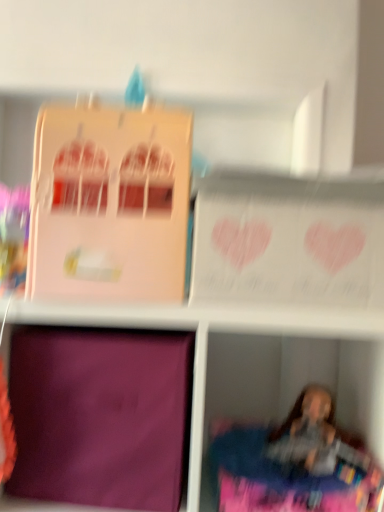
Question: Is purple fabric at lower left aimed at pink matte cardboard box at upper left, which is counted as the second cardboard box, starting from the bottom?

Choices:
 (A) no
 (B) yes

Answer: (A)

Question: Does purple fabric at lower left appear on the left side of pink matte cardboard box at upper left, which is counted as the second cardboard box, starting from the bottom?

Choices:
 (A) no
 (B) yes

Answer: (A)

Question: Considering the relative positions of purple fabric at lower left and pink matte cardboard box at upper left, the 1th cardboard box positioned from the top, in the image provided, is purple fabric at lower left behind pink matte cardboard box at upper left, the 1th cardboard box positioned from the top,?

Choices:
 (A) yes
 (B) no

Answer: (B)

Question: From a real-world perspective, is purple fabric at lower left beneath pink matte cardboard box at upper left, the 1th cardboard box positioned from the top?

Choices:
 (A) yes
 (B) no

Answer: (A)

Question: From a real-world perspective, is purple fabric at lower left on pink matte cardboard box at upper left, which is counted as the second cardboard box, starting from the bottom?

Choices:
 (A) no
 (B) yes

Answer: (A)

Question: Is purple matte cardboard box at lower left, the 2th cardboard box when ordered from top to bottom, spatially inside purple fabric at lower left, or outside of it?

Choices:
 (A) outside
 (B) inside

Answer: (B)

Question: From a real-world perspective, is purple matte cardboard box at lower left, the 1th cardboard box from the bottom, above or below purple fabric at lower left?

Choices:
 (A) below
 (B) above

Answer: (B)

Question: In terms of size, does purple matte cardboard box at lower left, the 1th cardboard box from the bottom, appear bigger or smaller than purple fabric at lower left?

Choices:
 (A) big
 (B) small

Answer: (B)

Question: From the image's perspective, is purple matte cardboard box at lower left, the 2th cardboard box when ordered from top to bottom, located above or below purple fabric at lower left?

Choices:
 (A) below
 (B) above

Answer: (B)

Question: Is pink matte cardboard box at upper left, the 1th cardboard box positioned from the top, taller or shorter than purple fabric at lower left?

Choices:
 (A) tall
 (B) short

Answer: (B)

Question: Would you say pink matte cardboard box at upper left, which is counted as the second cardboard box, starting from the bottom, is inside or outside purple fabric at lower left?

Choices:
 (A) inside
 (B) outside

Answer: (B)

Question: Is point (34, 182) positioned closer to the camera than point (145, 309)?

Choices:
 (A) closer
 (B) farther

Answer: (A)

Question: Is pink matte cardboard box at upper left, the 1th cardboard box positioned from the top, in front of or behind purple fabric at lower left in the image?

Choices:
 (A) front
 (B) behind

Answer: (B)

Question: Choose the correct answer: Is purple matte cardboard box at lower left, the 1th cardboard box from the bottom, inside pink matte cardboard box at upper left, which is counted as the second cardboard box, starting from the bottom, or outside it?

Choices:
 (A) inside
 (B) outside

Answer: (B)

Question: In the image, is purple matte cardboard box at lower left, the 2th cardboard box when ordered from top to bottom, positioned in front of or behind pink matte cardboard box at upper left, which is counted as the second cardboard box, starting from the bottom?

Choices:
 (A) front
 (B) behind

Answer: (B)